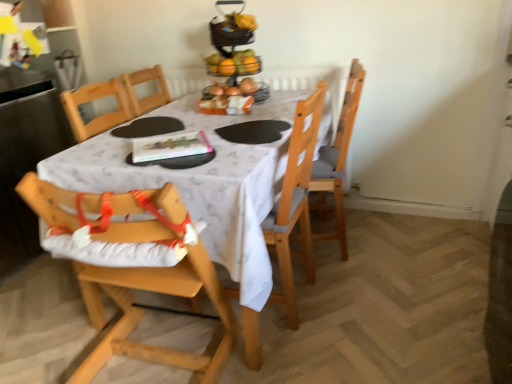
The image size is (512, 384). What are the coordinates of `vacant space in front of orange plastic basket at center` in the screenshot? It's located at (216, 118).